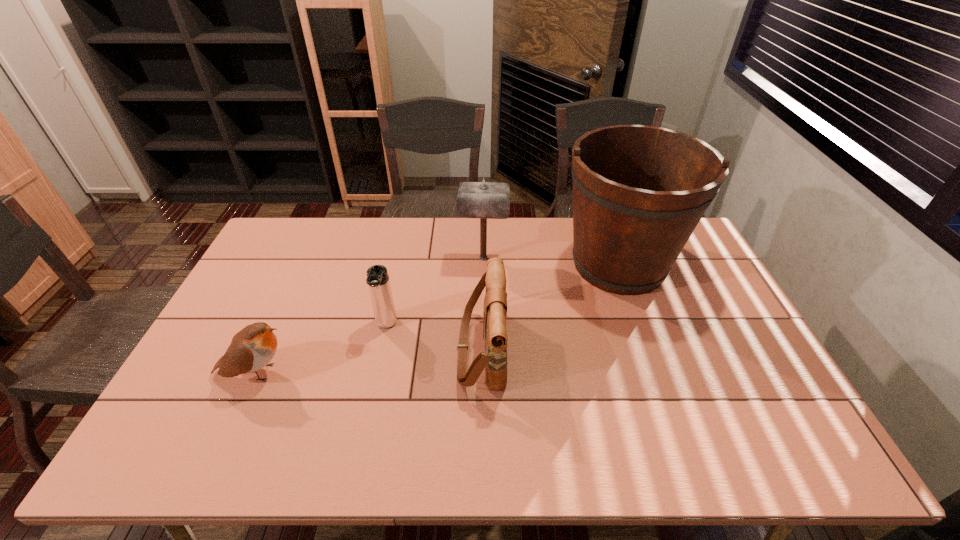
Locate an element on the screen. the rightmost object is located at coordinates (639, 191).

Find the location of a particular element. The height and width of the screenshot is (540, 960). bucket is located at coordinates (639, 191).

Where is `mallet`? The height and width of the screenshot is (540, 960). mallet is located at coordinates (486, 200).

Image resolution: width=960 pixels, height=540 pixels. I want to click on shoulder bag, so click(x=494, y=360).

Where is `thermos bottle`? This screenshot has height=540, width=960. thermos bottle is located at coordinates (378, 280).

Find the location of `bird`. bird is located at coordinates pos(252,348).

Where is `vacant area situated 0.190m on the left of the rightmost object`? This screenshot has height=540, width=960. vacant area situated 0.190m on the left of the rightmost object is located at coordinates (502, 265).

Find the location of a particular element. vacant space located 0.360m on the front of the mallet is located at coordinates pos(485,352).

Find the location of a particular element. The height and width of the screenshot is (540, 960). vacant region located on the front-facing side of the shoulder bag is located at coordinates (407, 349).

Where is `vacant space located on the front-facing side of the shoulder bag`? The image size is (960, 540). vacant space located on the front-facing side of the shoulder bag is located at coordinates (348, 349).